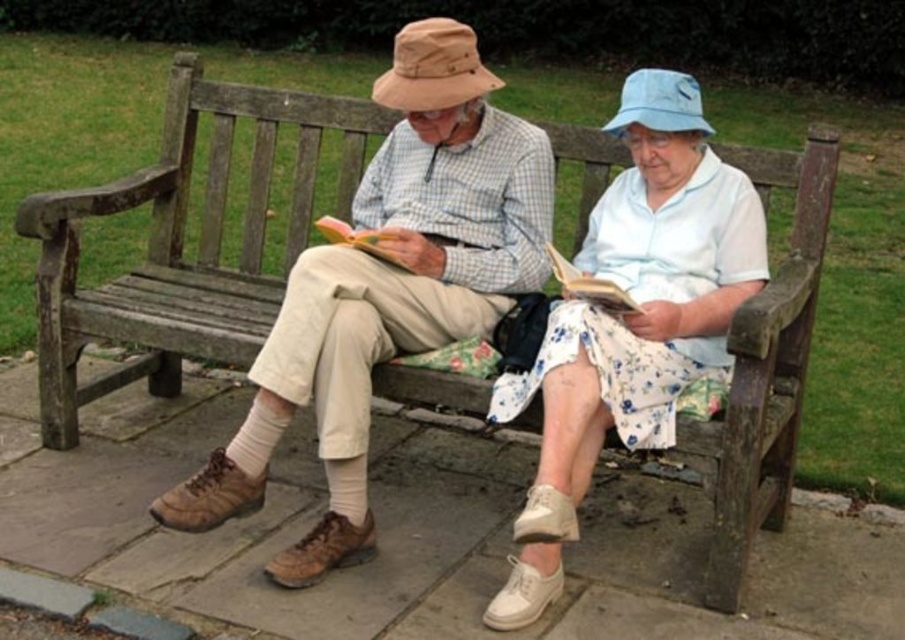
You are a photographer trying to capture a clear shot of the white floral skirt at center without the brown leather shoes at center blocking it. Can you adjust your position to do so?

The brown leather shoes at center is positioned over white floral skirt at center, so adjusting your position might not be possible as the shoes are directly covering the skirt in the current arrangement.

You are a photographer trying to capture a closeup of the hardcover book at center without including the brown leather shoes at center in the frame. Given their positions, is this possible?

The brown leather shoes at center is positioned on the left side of hardcover book at center, so to avoid including the shoes in the frame, the photographer can position the camera to the right side of the book, ensuring the shoes are out of the shot.

You are a delivery robot with a package that needs to be placed between the brown leather shoes at center and the hardcover book at center. The package is 20 inches long. Can you fit it there?

The distance between the brown leather shoes at center and the hardcover book at center is 19.39 inches. Since the package is 20 inches long, it cannot fit in the available space.